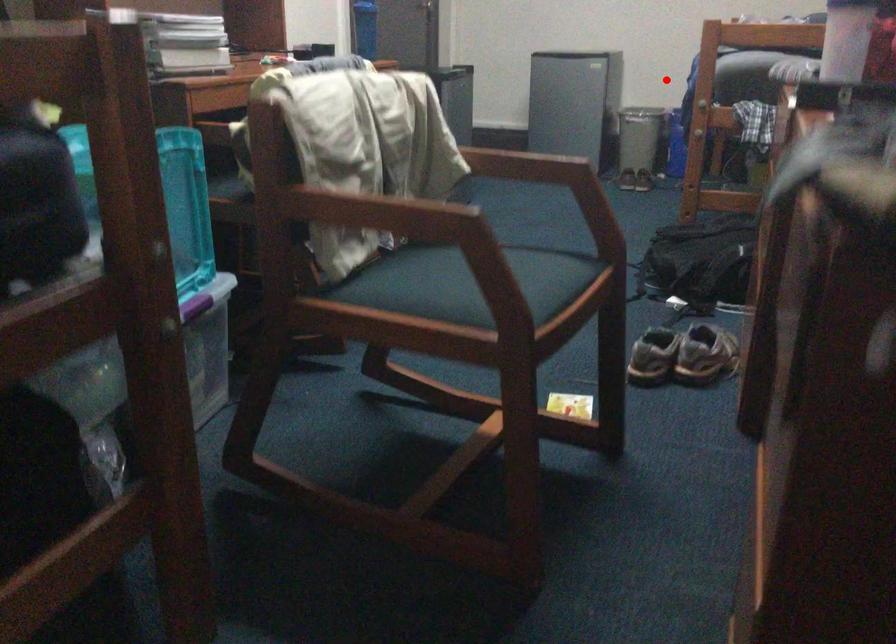
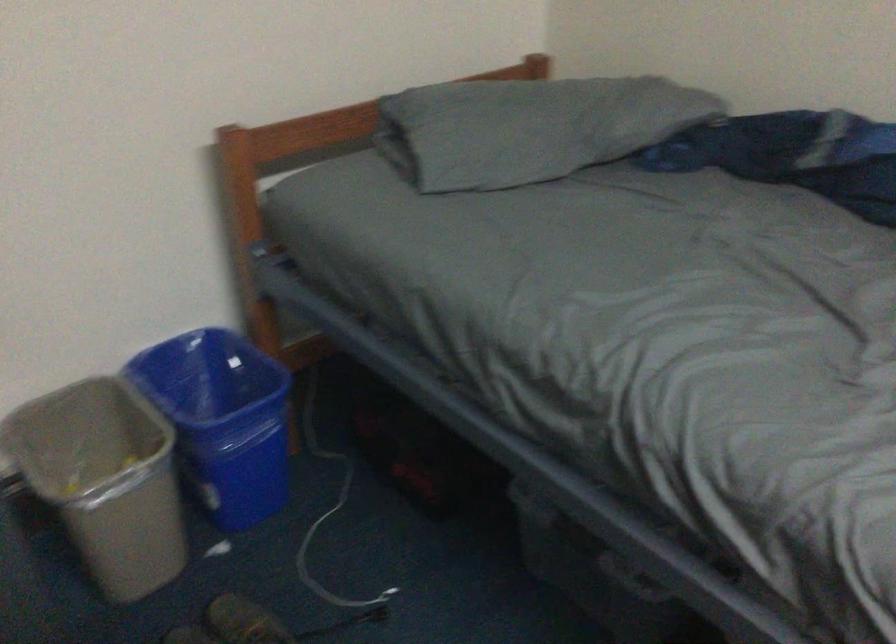
Locate, in the second image, the point that corresponds to the highlighted location in the first image.

(221, 420)